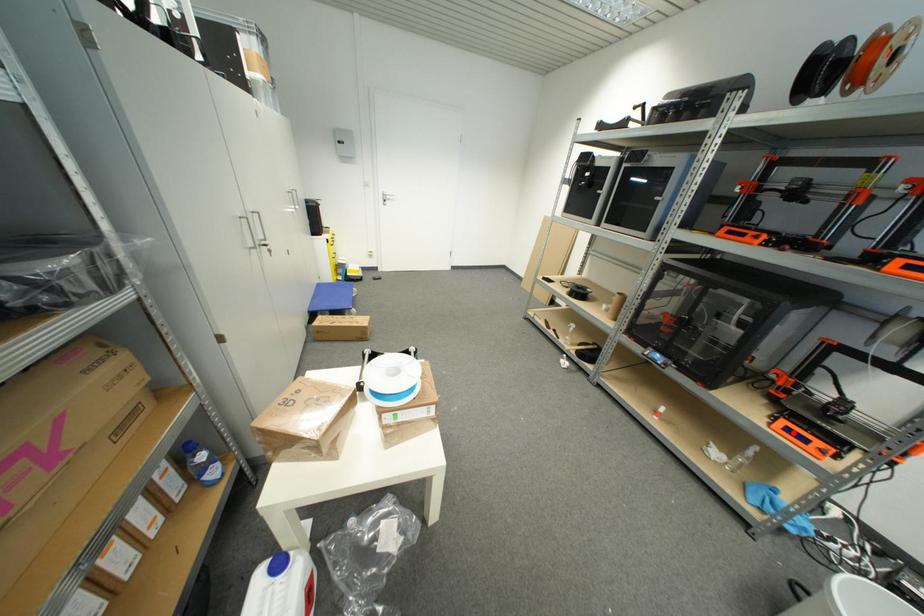
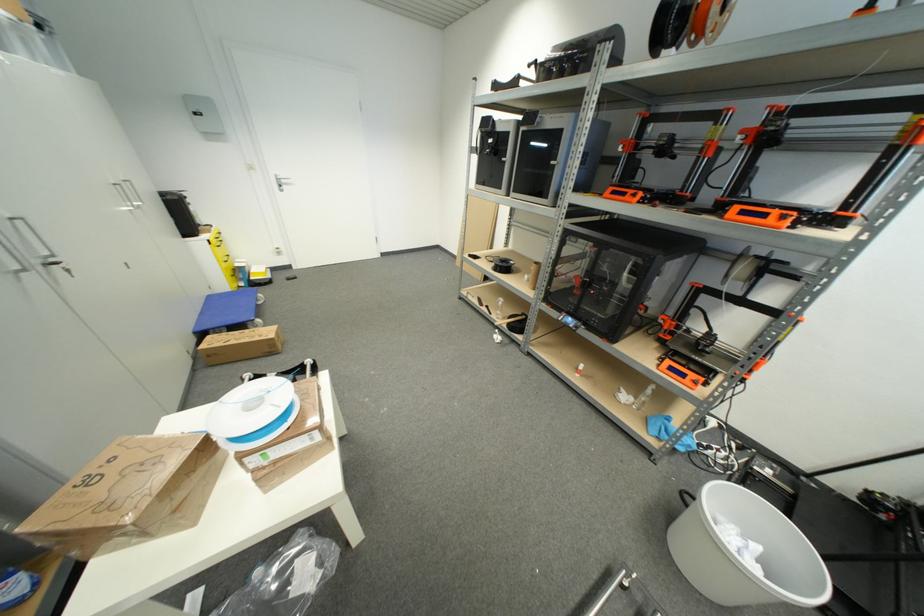
In the second image, find the point that corresponds to the highlighted location in the first image.

(675, 371)